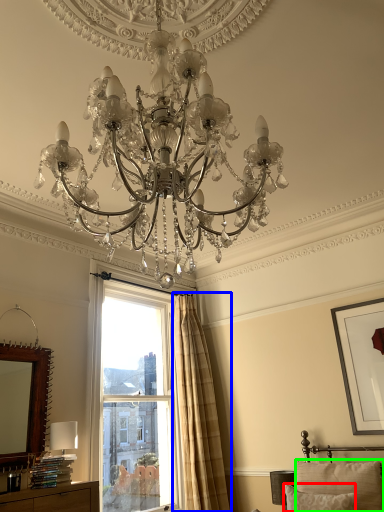
Question: Which is nearer to the pillow (highlighted by a red box)? curtain (highlighted by a blue box) or pillow (highlighted by a green box).

Choices:
 (A) curtain
 (B) pillow

Answer: (B)